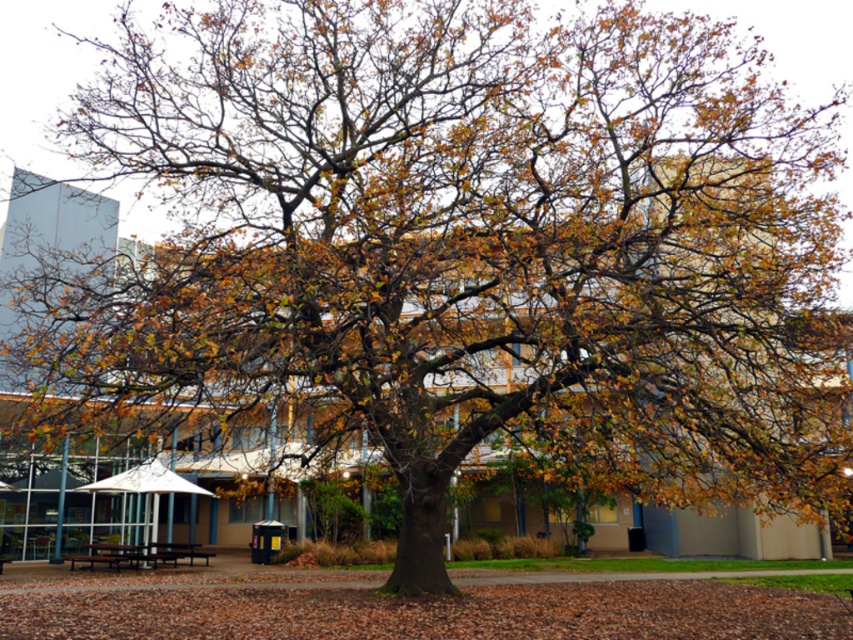
Which is more to the right, brown wooden picnic table at lower left or dark brown wooden bench at center?

From the viewer's perspective, dark brown wooden bench at center appears more on the right side.

This screenshot has height=640, width=853. Describe the element at coordinates (138, 554) in the screenshot. I see `brown wooden picnic table at lower left` at that location.

Image resolution: width=853 pixels, height=640 pixels. I want to click on brown wooden picnic table at lower left, so click(x=138, y=554).

Does wooden park bench at lower left have a lesser height compared to dark brown wooden bench at center?

Yes, wooden park bench at lower left is shorter than dark brown wooden bench at center.

Between wooden park bench at lower left and dark brown wooden bench at center, which one is positioned lower?

dark brown wooden bench at center is lower down.

I want to click on wooden park bench at lower left, so click(x=107, y=554).

Which is more to the left, brown wooden picnic table at lower left or wooden park bench at lower left?

wooden park bench at lower left

What do you see at coordinates (138, 554) in the screenshot?
I see `brown wooden picnic table at lower left` at bounding box center [138, 554].

Identify the location of brown wooden picnic table at lower left. Image resolution: width=853 pixels, height=640 pixels. (138, 554).